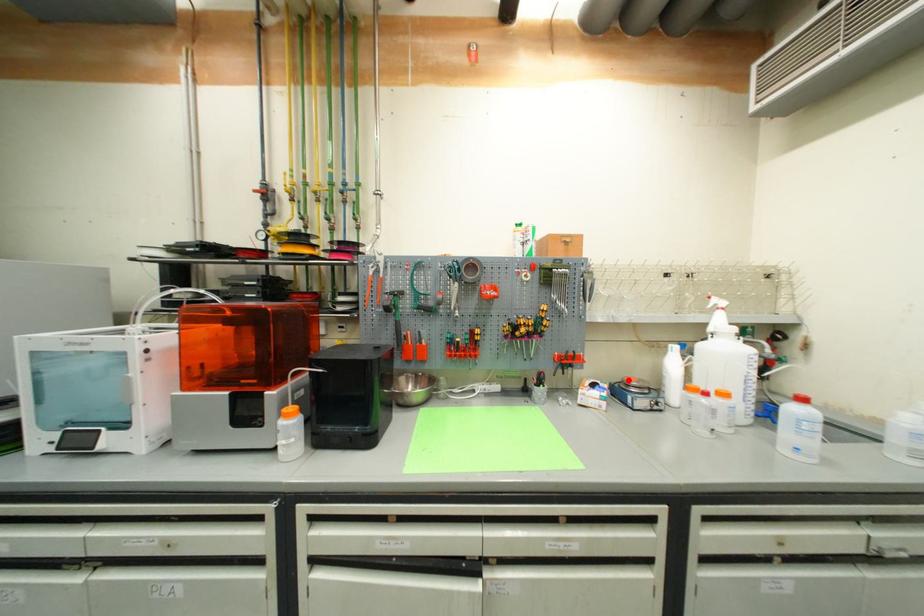
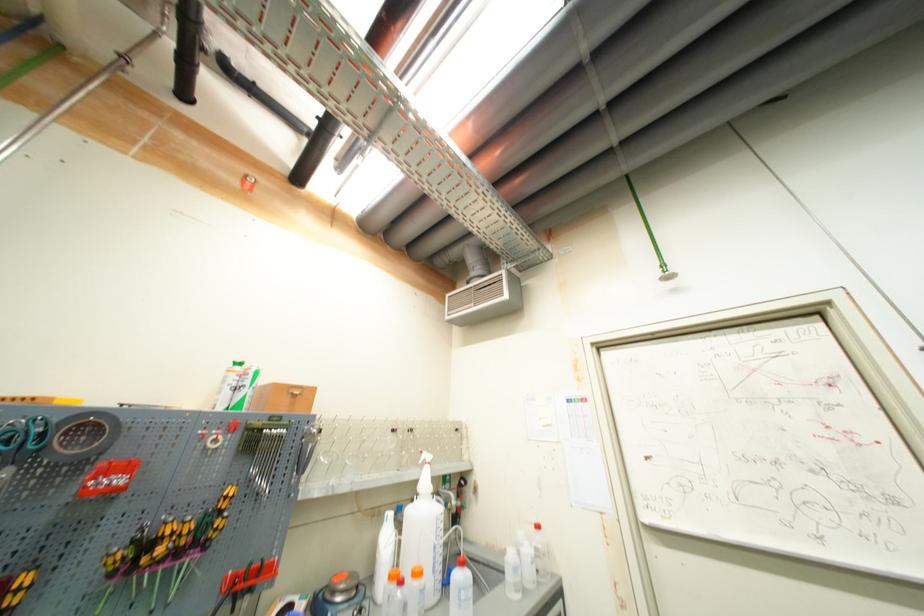
In the second image, find the point that corresponds to the highlighted location in the first image.

(335, 582)